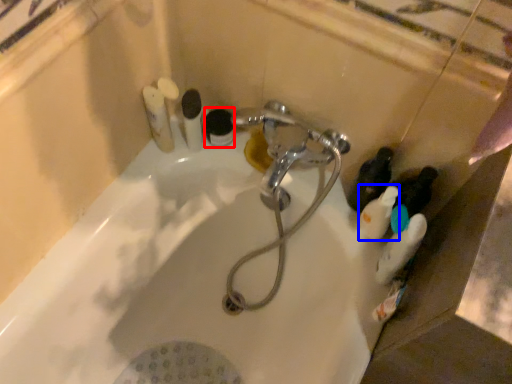
Question: Among these objects, which one is farthest to the camera, toiletry (highlighted by a red box) or toiletry (highlighted by a blue box)?

Choices:
 (A) toiletry
 (B) toiletry

Answer: (A)